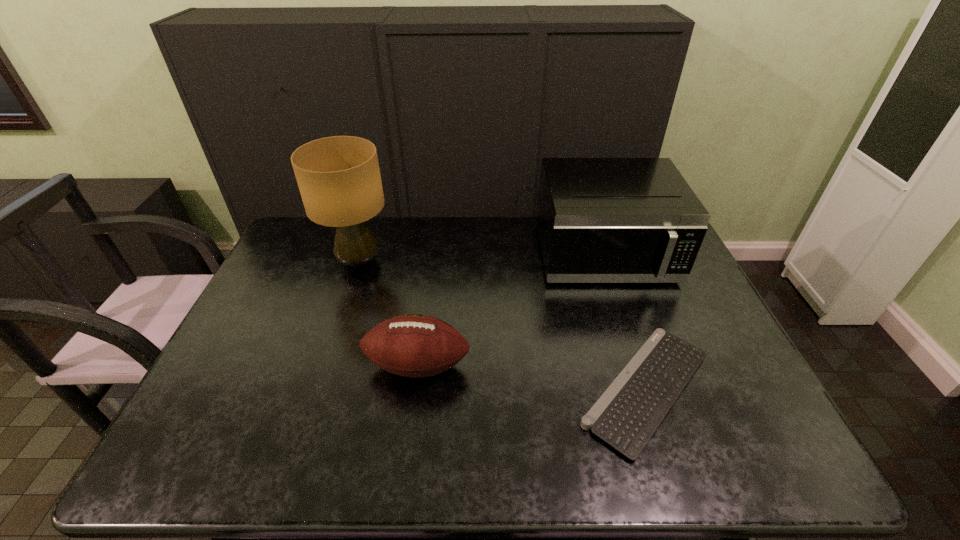
I want to click on object identified as the third closest to the football (American), so click(x=600, y=220).

The image size is (960, 540). Identify the location of free space that satisfies the following two spatial constraints: 1. on the front side of the lampshade; 2. on the right side of the football (American). (324, 366).